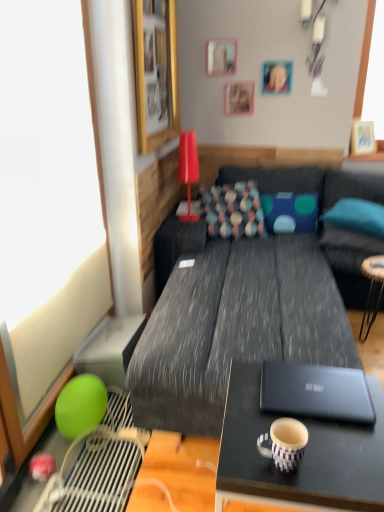
This screenshot has width=384, height=512. What are the coordinates of `vacant position to the left of porcelain textured mug at center` in the screenshot? It's located at (241, 456).